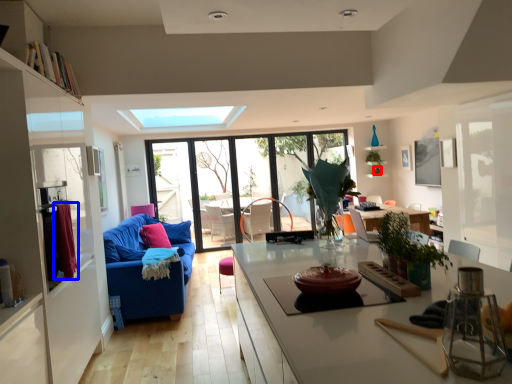
Question: Among these objects, which one is nearest to the camera, plant (highlighted by a red box) or curtain (highlighted by a blue box)?

Choices:
 (A) plant
 (B) curtain

Answer: (B)